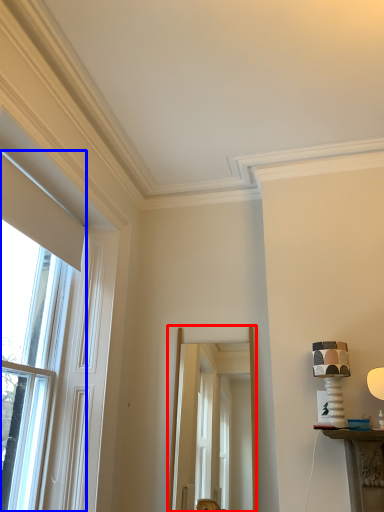
Question: Which object is closer to the camera taking this photo, screen door (highlighted by a red box) or window (highlighted by a blue box)?

Choices:
 (A) screen door
 (B) window

Answer: (B)